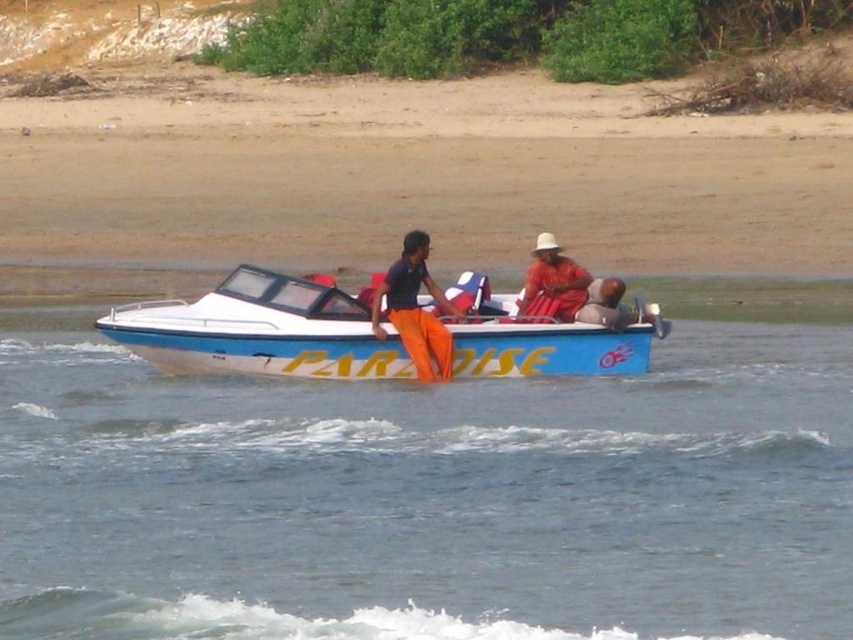
You are standing on the motorboat named PARADISE and want to move from the point at coordinate point (544, 449) to the point at coordinate point (544, 288). Which direction should you move in?

You should move backward since point (544, 449) is in front of point (544, 288).

You are standing on the shore and see the blue plastic boat at center and the orange fabric at center in the image. Which object is nearer to you?

The blue plastic boat at center is closer to you than the orange fabric at center.

You are standing on the sandy beach in the background of the image. You see a point marked at coordinates (x=260, y=330). What object is located at that point?

The blue glossy boat at center is located at point (x=260, y=330).